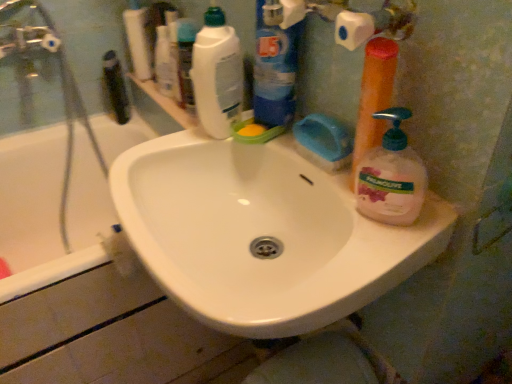
The height and width of the screenshot is (384, 512). What are the coordinates of `free space in front of orange plastic pump bottle at right, the third cleaning product viewed from the left` in the screenshot? It's located at (369, 248).